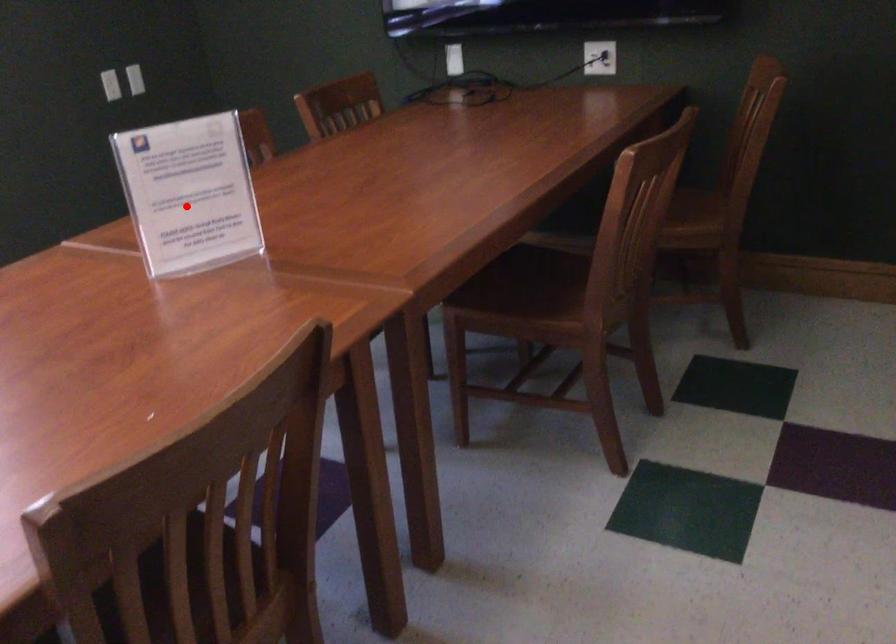
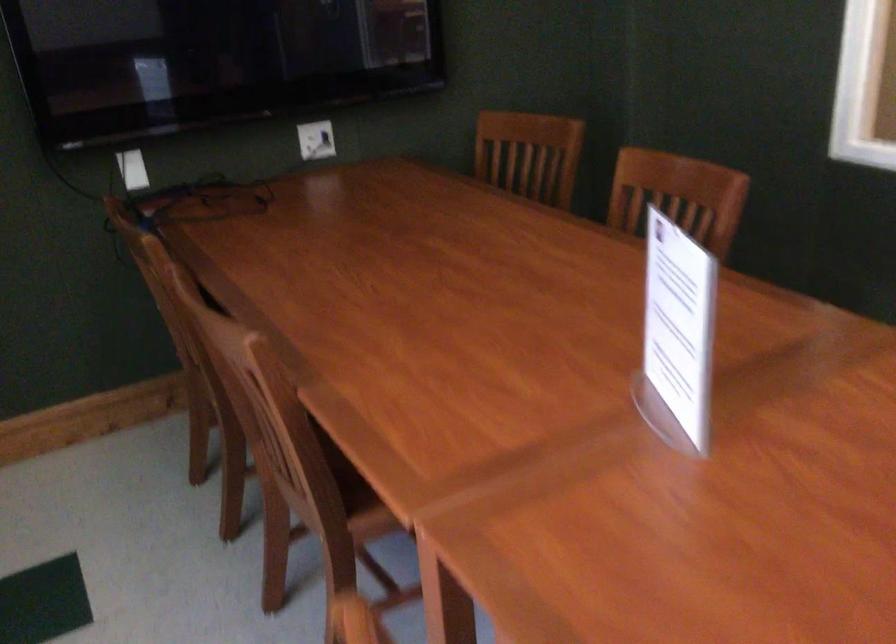
Question: A red point is marked in image1. In image2, is the corresponding 3D point closer to the camera or farther? Reply with the corresponding letter.

Choices:
 (A) The corresponding 3D point is closer.
 (B) The corresponding 3D point is farther.

Answer: (A)